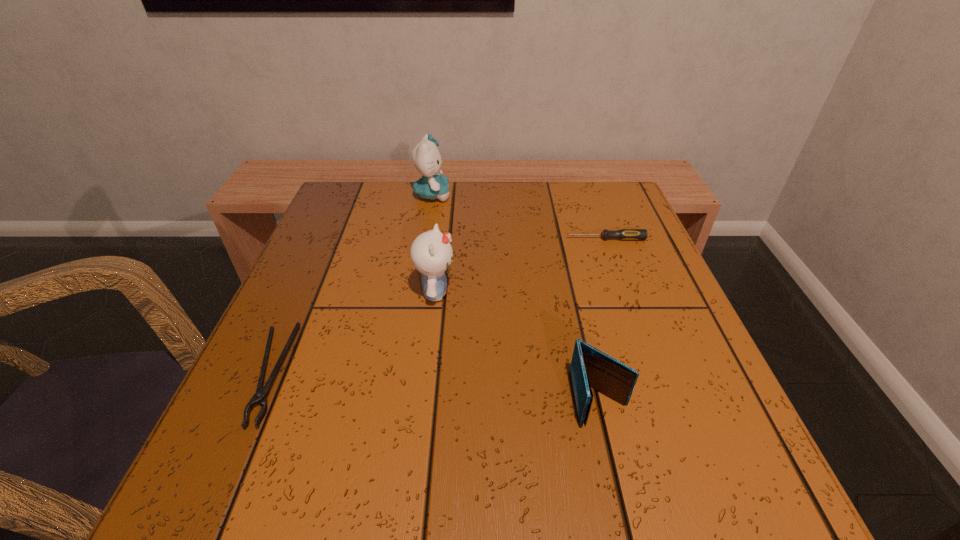
Image resolution: width=960 pixels, height=540 pixels. Identify the location of free space that satisfies the following two spatial constraints: 1. insert the second farthest object into a screw head; 2. on the exterior surface of the wallet. (663, 399).

Locate an element on the screen. This screenshot has width=960, height=540. vacant space that satisfies the following two spatial constraints: 1. insert the second farthest object into a screw head; 2. on the exterior surface of the wallet is located at coordinates (663, 399).

Identify the location of vacant space that satisfies the following two spatial constraints: 1. insert the fourth nearest object into a screw head; 2. on the exterior surface of the third tallest object. (663, 399).